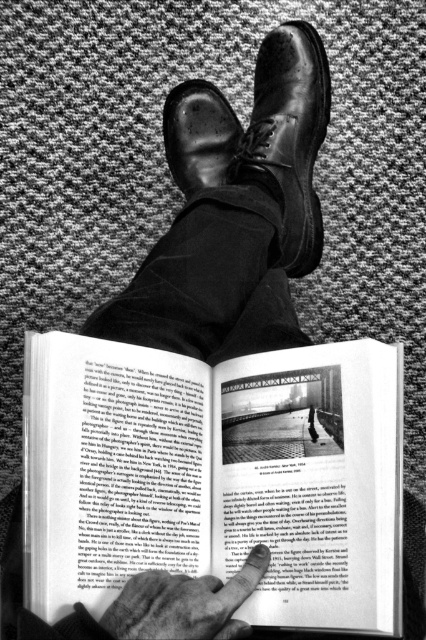
Question: Where is shiny leather shoe at center located in relation to smooth skin finger at lower center in the image?

Choices:
 (A) above
 (B) below

Answer: (A)

Question: Among these objects, which one is nearest to the camera?

Choices:
 (A) matte paper book at center
 (B) smooth skin finger at lower center

Answer: (B)

Question: Does matte paper book at center have a smaller size compared to smooth skin finger at lower center?

Choices:
 (A) no
 (B) yes

Answer: (A)

Question: Which of the following is the farthest from the observer?

Choices:
 (A) (143, 605)
 (B) (288, 221)
 (C) (226, 392)

Answer: (B)

Question: Which object is positioned closest to the smooth skin finger at lower center?

Choices:
 (A) matte paper book at center
 (B) shiny leather shoe at center

Answer: (A)

Question: Does matte paper book at center appear under shiny leather shoe at center?

Choices:
 (A) yes
 (B) no

Answer: (A)